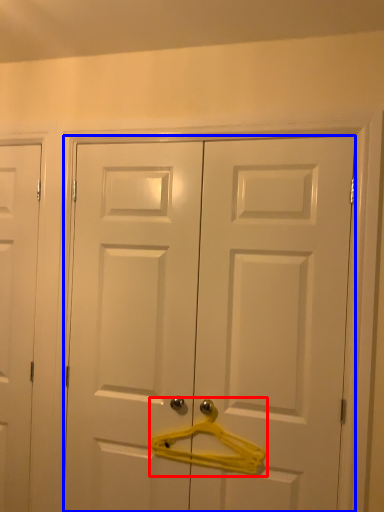
Question: Which of the following is the closest to the observer, hanger (highlighted by a red box) or door (highlighted by a blue box)?

Choices:
 (A) hanger
 (B) door

Answer: (B)